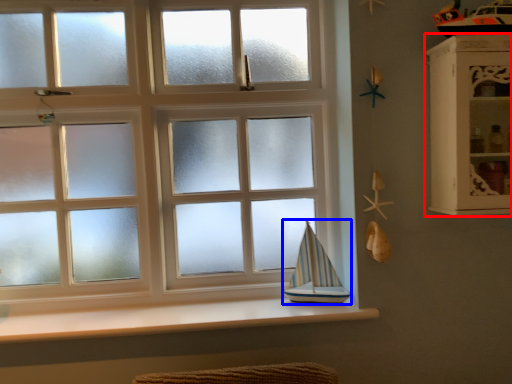
Question: Which point is closer to the camera, shelf (highlighted by a red box) or sailboat (highlighted by a blue box)?

Choices:
 (A) shelf
 (B) sailboat

Answer: (A)